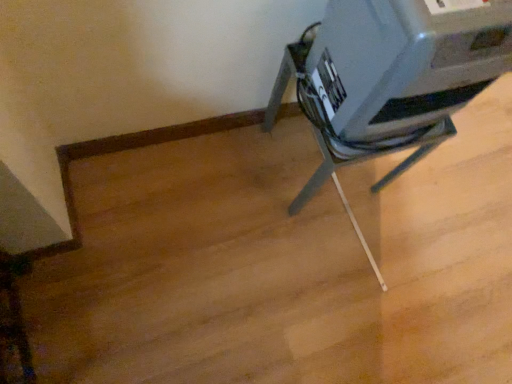
The height and width of the screenshot is (384, 512). I want to click on metallic gray printer at center, so click(365, 160).

What do you see at coordinates (365, 160) in the screenshot? This screenshot has width=512, height=384. I see `metallic gray printer at center` at bounding box center [365, 160].

What do you see at coordinates (405, 61) in the screenshot?
I see `satin gray printer at upper right` at bounding box center [405, 61].

The width and height of the screenshot is (512, 384). I want to click on satin gray printer at upper right, so click(405, 61).

At what (x,y) coordinates should I click in order to perform the action: click on metallic gray printer at center. Please return your answer as a coordinate pair (x, y). Looking at the image, I should click on click(365, 160).

Considering the positions of objects satin gray printer at upper right and metallic gray printer at center in the image provided, who is more to the left, satin gray printer at upper right or metallic gray printer at center?

metallic gray printer at center is more to the left.

Is satin gray printer at upper right positioned in front of metallic gray printer at center?

Yes, satin gray printer at upper right is in front of metallic gray printer at center.

Which is in front, point (343, 117) or point (385, 152)?

The point (343, 117) is in front.

From the image's perspective, does satin gray printer at upper right appear lower than metallic gray printer at center?

No, from the image's perspective, satin gray printer at upper right is not below metallic gray printer at center.

From a real-world perspective, is satin gray printer at upper right positioned above or below metallic gray printer at center?

Clearly, from a real-world perspective, satin gray printer at upper right is above metallic gray printer at center.

From the picture: Considering the relative sizes of satin gray printer at upper right and metallic gray printer at center in the image provided, is satin gray printer at upper right thinner than metallic gray printer at center?

Yes, satin gray printer at upper right is thinner than metallic gray printer at center.

Which of these two, satin gray printer at upper right or metallic gray printer at center, stands taller?

Standing taller between the two is metallic gray printer at center.

Can you confirm if satin gray printer at upper right is smaller than metallic gray printer at center?

Yes.

Is satin gray printer at upper right not inside metallic gray printer at center?

satin gray printer at upper right is positioned outside metallic gray printer at center.

Is satin gray printer at upper right far from metallic gray printer at center?

No, satin gray printer at upper right is in close proximity to metallic gray printer at center.

Is satin gray printer at upper right aimed at metallic gray printer at center?

No, satin gray printer at upper right is not facing towards metallic gray printer at center.

What's the angular difference between satin gray printer at upper right and metallic gray printer at center's facing directions?

There is a 0.107-degree angle between the facing directions of satin gray printer at upper right and metallic gray printer at center.

This screenshot has height=384, width=512. I want to click on furniture lying on the left of satin gray printer at upper right, so click(x=365, y=160).

Considering the positions of objects metallic gray printer at center and satin gray printer at upper right in the image provided, who is more to the right, metallic gray printer at center or satin gray printer at upper right?

From the viewer's perspective, satin gray printer at upper right appears more on the right side.

Does metallic gray printer at center lie behind satin gray printer at upper right?

Yes, metallic gray printer at center is further from the viewer.

Is point (449, 130) behind point (474, 12)?

Yes, it is.

From the image's perspective, between metallic gray printer at center and satin gray printer at upper right, who is located below?

Answer: metallic gray printer at center appears lower in the image.

From the picture: From a real-world perspective, is metallic gray printer at center positioned over satin gray printer at upper right based on gravity?

No, from a real-world perspective, metallic gray printer at center is not over satin gray printer at upper right

Considering the relative sizes of metallic gray printer at center and satin gray printer at upper right in the image provided, is metallic gray printer at center thinner than satin gray printer at upper right?

Incorrect, the width of metallic gray printer at center is not less than that of satin gray printer at upper right.

Which of these two, metallic gray printer at center or satin gray printer at upper right, stands shorter?

With less height is satin gray printer at upper right.

Based on their sizes in the image, would you say metallic gray printer at center is bigger or smaller than satin gray printer at upper right?

In the image, metallic gray printer at center appears to be larger than satin gray printer at upper right.

Would you say metallic gray printer at center contains satin gray printer at upper right?

No, metallic gray printer at center does not contain satin gray printer at upper right.

Is metallic gray printer at center positioned far away from satin gray printer at upper right?

metallic gray printer at center is near satin gray printer at upper right, not far away.

Is metallic gray printer at center aimed at satin gray printer at upper right?

No, metallic gray printer at center is not aimed at satin gray printer at upper right.

Can you tell me how much metallic gray printer at center and satin gray printer at upper right differ in facing direction?

They differ by 0.107 degrees in their facing directions.

Measure the distance from metallic gray printer at center to satin gray printer at upper right.

metallic gray printer at center and satin gray printer at upper right are 8.04 inches apart.

The image size is (512, 384). I want to click on furniture below the satin gray printer at upper right (from the image's perspective), so click(365, 160).

Identify the location of furniture below the satin gray printer at upper right (from the image's perspective). This screenshot has height=384, width=512. (365, 160).

The height and width of the screenshot is (384, 512). I want to click on furniture that appears behind the satin gray printer at upper right, so (x=365, y=160).